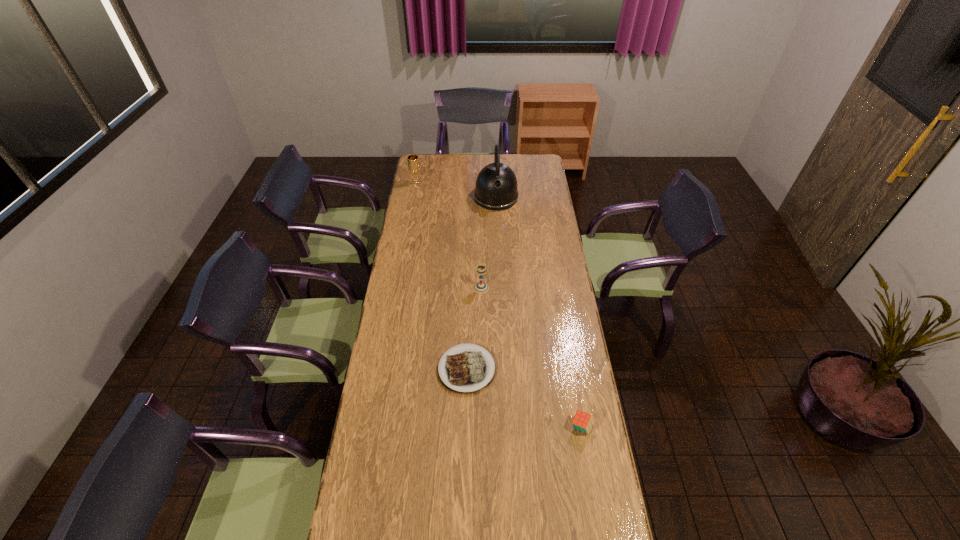
You are a GUI agent. You are given a task and a screenshot of the screen. Output one action in this format:
    pyautogui.click(x=<x>, y=<y>)
    Task: Click on the kettle
    This screenshot has width=960, height=540.
    Given the screenshot: What is the action you would take?
    pyautogui.click(x=496, y=188)

The image size is (960, 540). In order to click on the farther chalice in this screenshot , I will do `click(413, 162)`.

Find the location of a particular element. This screenshot has width=960, height=540. the taller chalice is located at coordinates (413, 162).

The height and width of the screenshot is (540, 960). In order to click on the shorter chalice in this screenshot , I will do `click(480, 287)`.

I want to click on the third farthest object, so click(x=480, y=287).

Where is `cube`? Image resolution: width=960 pixels, height=540 pixels. cube is located at coordinates (582, 421).

The height and width of the screenshot is (540, 960). Identify the location of the rightmost object. (582, 421).

This screenshot has height=540, width=960. What are the coordinates of `the fourth farthest object` in the screenshot? It's located at (468, 369).

The image size is (960, 540). Identify the location of plate. (468, 369).

The image size is (960, 540). Find the location of `free spot located on the spout of the tallest object`. free spot located on the spout of the tallest object is located at coordinates (498, 238).